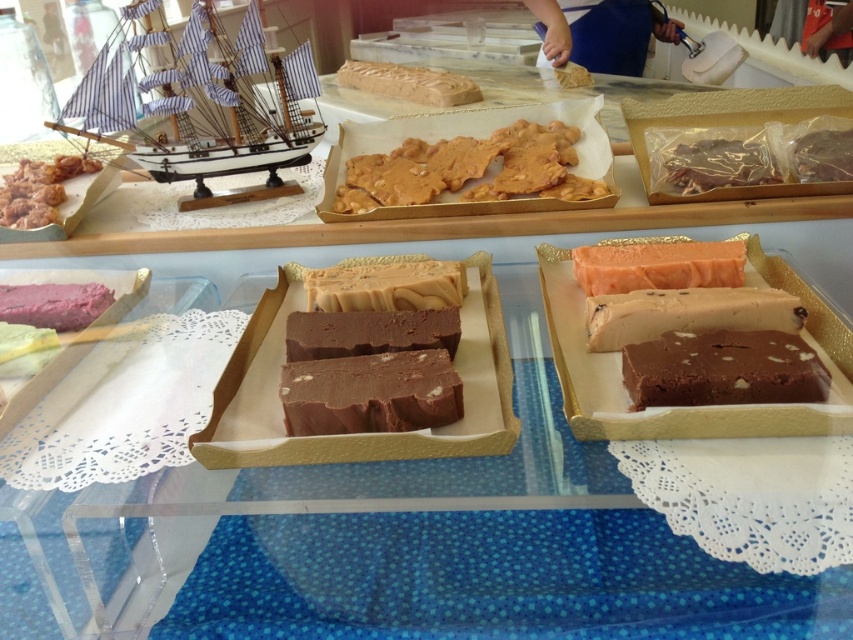
You are a customer who wants to pick up the smooth caramel bar at center and the translucent plastic bag at upper right. If you can only reach 1.20 meters, will you be able to grab both items without moving your position?

The translucent plastic bag at upper right is 1.30 meters away from the smooth caramel bar at center. Since your reach is only 1.20 meters, you cannot reach both items simultaneously without moving your position.

Consider the image. You are a customer at the candy display. You want to pick up the golden crunchy candy at center and the smooth caramel bar at center. Which one do you need to reach further for?

The smooth caramel bar at center requires reaching further because it is farther from the viewer compared to the golden crunchy candy at center.